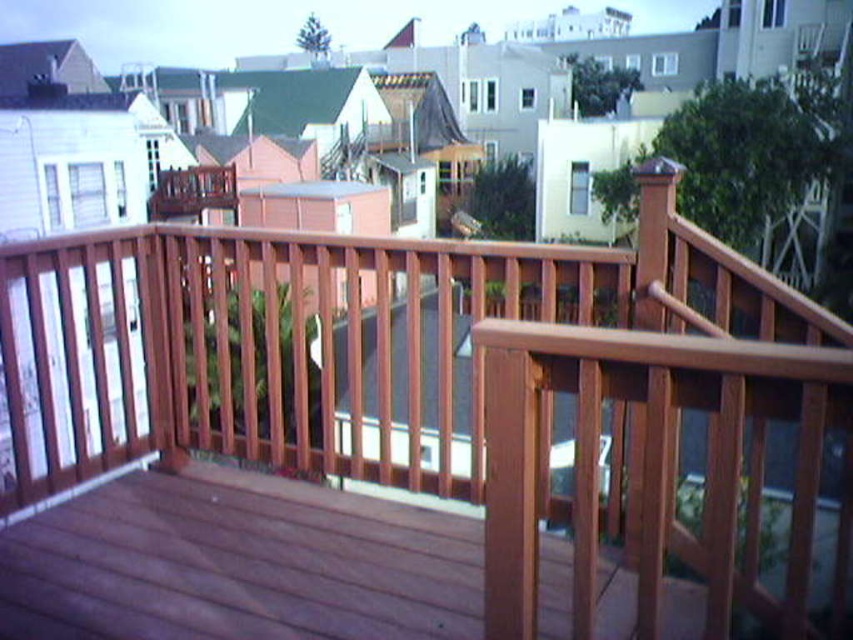
Is smooth wood deck at center positioned at the back of wooden deck at center?

No, it is in front of wooden deck at center.

Who is positioned more to the left, smooth wood deck at center or wooden deck at center?

wooden deck at center

Between point (136, 612) and point (213, 198), which one is positioned in front?

Positioned in front is point (136, 612).

I want to click on smooth wood deck at center, so click(x=238, y=563).